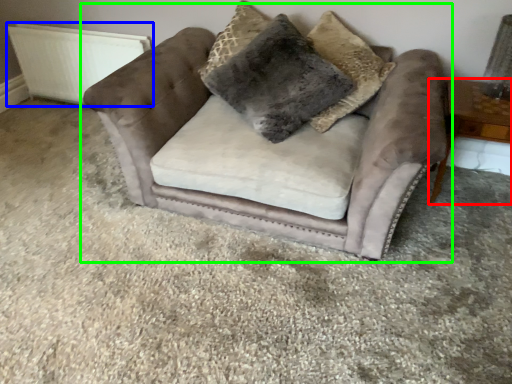
Question: Based on their relative distances, which object is farther from table (highlighted by a red box)? Choose from radiator (highlighted by a blue box) and chair (highlighted by a green box).

Choices:
 (A) radiator
 (B) chair

Answer: (A)